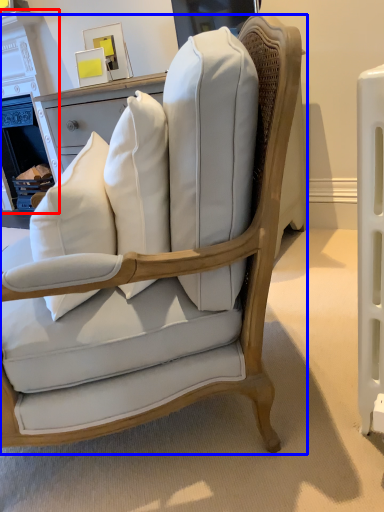
Question: Which object appears closest to the camera in this image, fireplace (highlighted by a red box) or chair (highlighted by a blue box)?

Choices:
 (A) fireplace
 (B) chair

Answer: (B)